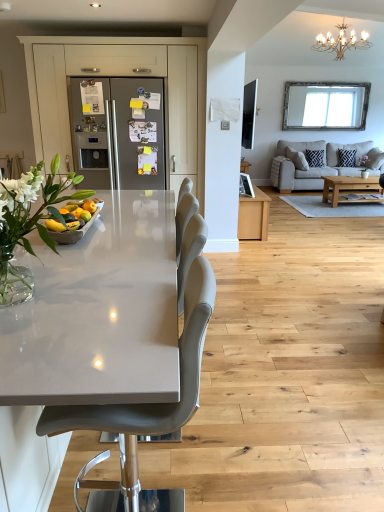
Identify the location of vacant space behind clear glass vase at center. pyautogui.click(x=104, y=260).